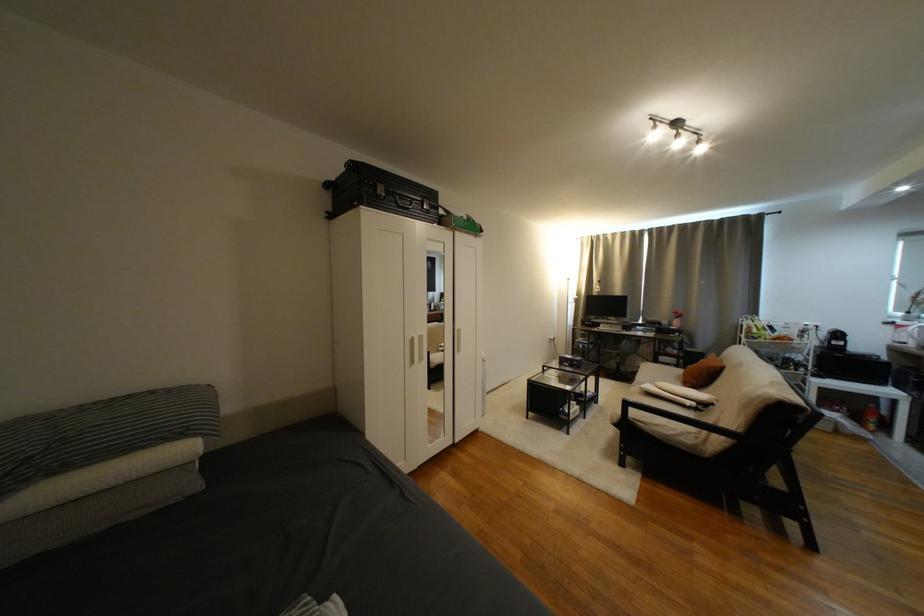
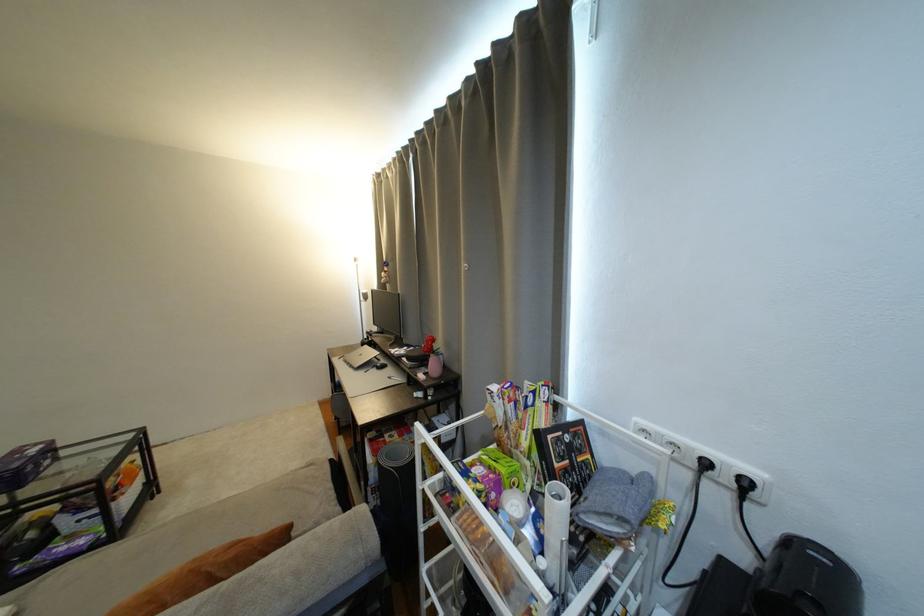
Find the pixel in the second image that matches (824,329) in the first image.

(754, 485)